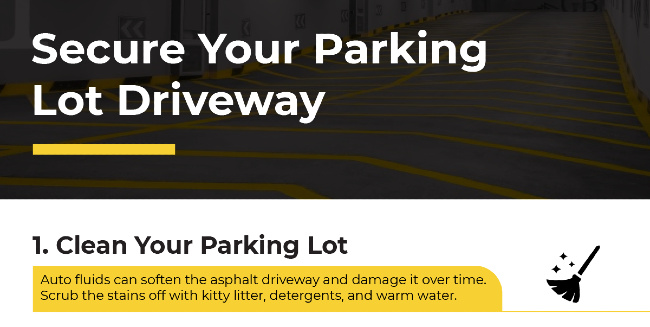
Locate an element on the screen. Image resolution: width=650 pixels, height=327 pixels. broom is located at coordinates (567, 281).